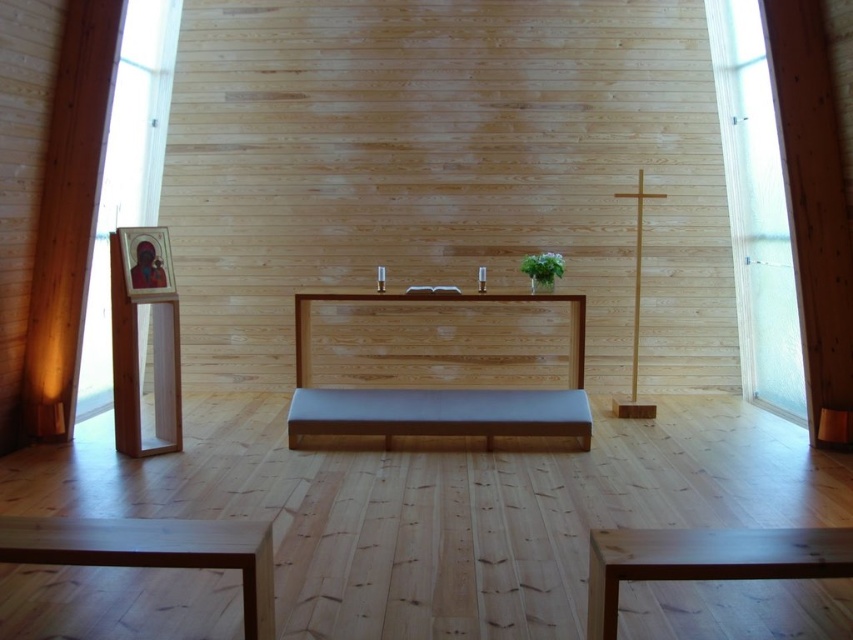
You are an interior designer planning to place a new decorative item between the smooth brown bench at center and the natural wood pulpit at center. Based on their positions, where exactly should you place the item?

The smooth brown bench at center is positioned under the natural wood pulpit at center, so the decorative item should be placed below the natural wood pulpit at center and above the smooth brown bench at center to maintain alignment.

You are standing in the chapel and want to determine the spatial relationship between two points marked in the scene. Which point is closer to you, point (x=772, y=237) or point (x=296, y=420)?

Point (x=772, y=237) is further to the viewer than point (x=296, y=420), so point (x=296, y=420) is closer to you.